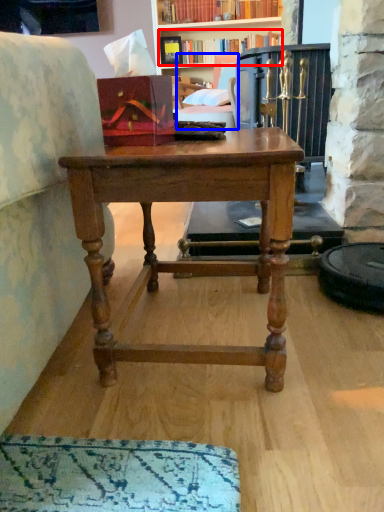
Question: Which object is further to the camera taking this photo, book (highlighted by a red box) or swivel chair (highlighted by a blue box)?

Choices:
 (A) book
 (B) swivel chair

Answer: (A)